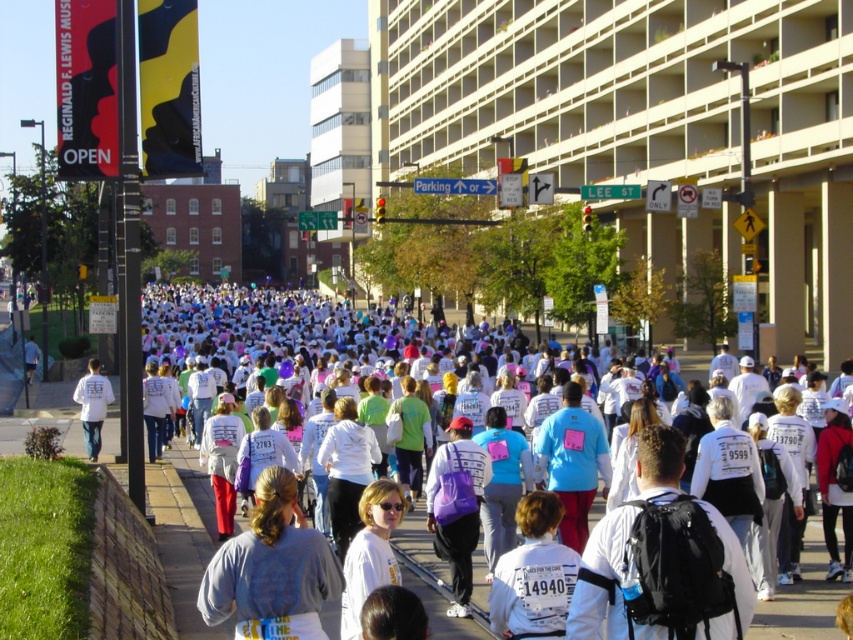
Question: Which of the following is the closest to the observer?

Choices:
 (A) white matte shirt at lower left
 (B) gray cotton shirt at lower left
 (C) white fabric crowd at center

Answer: (B)

Question: Does gray cotton shirt at lower left have a lesser width compared to purple fabric bag at center?

Choices:
 (A) yes
 (B) no

Answer: (B)

Question: Which of these objects is positioned closest to the gray cotton shirt at lower left?

Choices:
 (A) purple fabric bag at center
 (B) white matte shirt at lower left

Answer: (A)

Question: Can you confirm if white fabric crowd at center is bigger than gray cotton shirt at lower left?

Choices:
 (A) yes
 (B) no

Answer: (A)

Question: Considering the relative positions of white fabric crowd at center and purple fabric bag at center in the image provided, where is white fabric crowd at center located with respect to purple fabric bag at center?

Choices:
 (A) right
 (B) left

Answer: (B)

Question: Which of the following is the closest to the observer?

Choices:
 (A) (471, 493)
 (B) (260, 572)
 (C) (737, 586)
 (D) (91, 433)

Answer: (C)